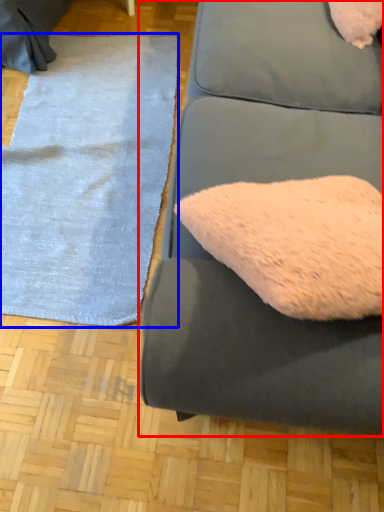
Question: Which of the following is the farthest to the observer, studio couch (highlighted by a red box) or mat (highlighted by a blue box)?

Choices:
 (A) studio couch
 (B) mat

Answer: (B)